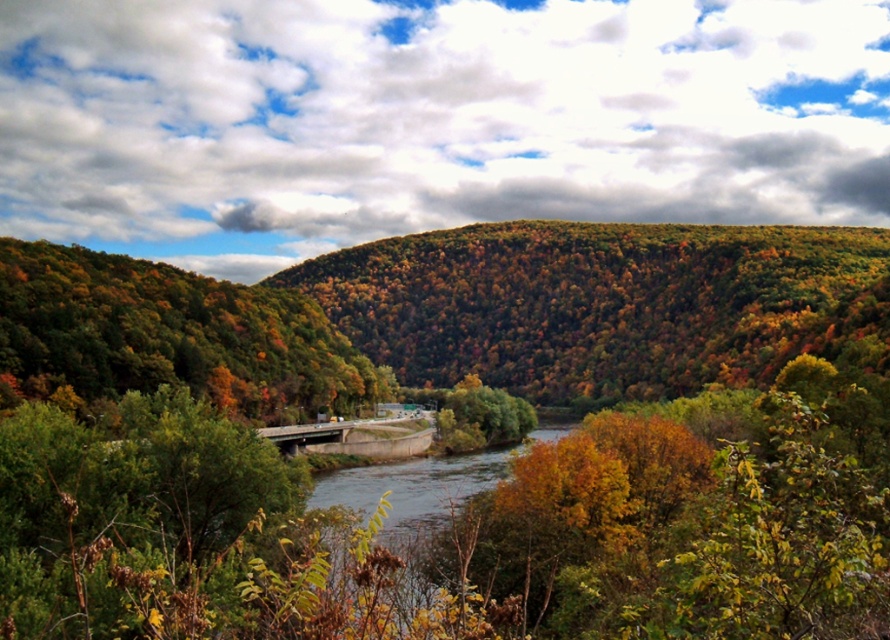
You are standing at the point with coordinates point (x=320, y=353) and want to walk to the point with coordinates point (x=619, y=348). Given that the path between them is clear, will you have to go over any obstacles like the concrete bridge spanning the river? Please explain your reasoning based on the scene description.

Based on the scene description, the point (x=619, y=348) is behind point (x=320, y=353). Since the path between them is clear and there is a concrete bridge spanning the river in the scene, you would not need to go over the bridge to reach the destination because the two points are positioned such that the target point is behind the starting point, likely on the same side of the river. The bridge connects both sides of the valley, but since the destination is behind the starting point, it suggests they are on a

You are standing on the concrete bridge at center and want to take a photo of the autumn foliage at center. In which direction should you point your camera?

You should point your camera to the right because the autumn foliage at center is to the right of the concrete bridge at center.